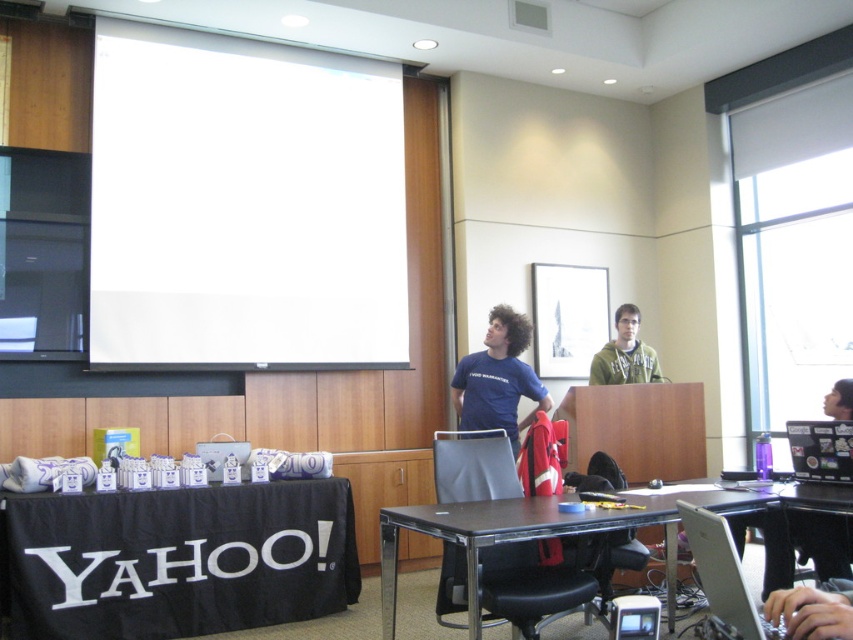
You are standing in the conference room and want to pick up the item located at point (490, 426). Can you reach it without moving closer to the table?

The point (490, 426) is 15.57 feet from the viewer, so you cannot reach it without moving closer to the table.